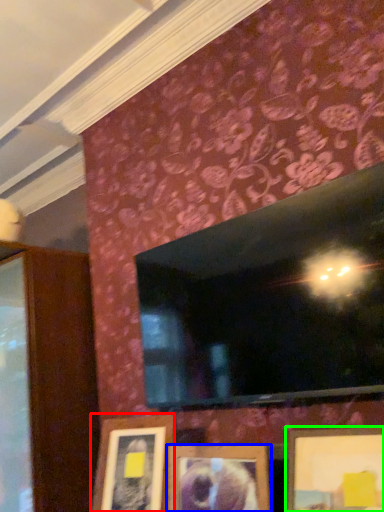
Question: Considering the real-world distances, which object is closest to picture frame (highlighted by a red box)? picture frame (highlighted by a blue box) or picture frame (highlighted by a green box).

Choices:
 (A) picture frame
 (B) picture frame

Answer: (A)